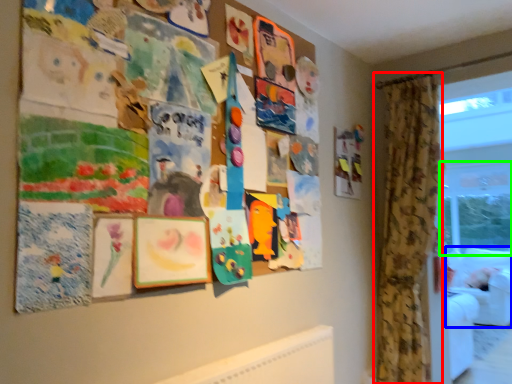
Question: Based on their relative distances, which object is farther from curtain (highlighted by a red box)? Choose from couch (highlighted by a blue box) and window screen (highlighted by a green box).

Choices:
 (A) couch
 (B) window screen

Answer: (B)